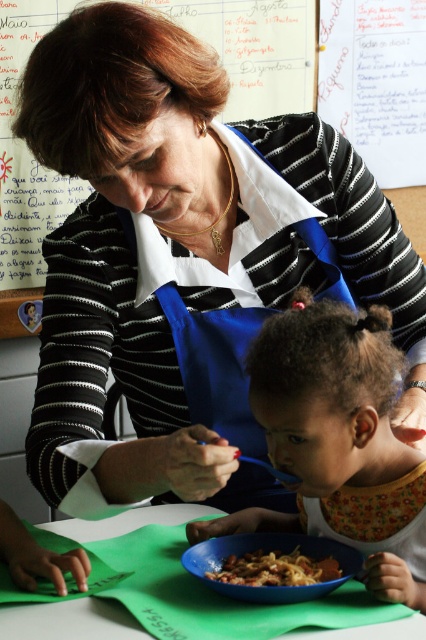
Question: Considering the relative positions of floral bib at lower center and matte plastic bowl at center in the image provided, where is floral bib at lower center located with respect to matte plastic bowl at center?

Choices:
 (A) right
 (B) left

Answer: (A)

Question: Which object is positioned closest to the white paper at upper center?

Choices:
 (A) floral bib at lower center
 (B) matte plastic bowl at center
 (C) green paper at lower center

Answer: (A)

Question: Can you confirm if green paper at lower center is bigger than matte plastic bowl at center?

Choices:
 (A) yes
 (B) no

Answer: (A)

Question: Which object appears closest to the camera in this image?

Choices:
 (A) floral bib at lower center
 (B) white paper at upper center
 (C) green paper at lower center

Answer: (C)

Question: Observing the image, what is the correct spatial positioning of floral bib at lower center in reference to shiny plastic bowl at center?

Choices:
 (A) left
 (B) right

Answer: (B)

Question: Which point is farther to the camera?

Choices:
 (A) green paper at lower center
 (B) shiny plastic bowl at center

Answer: (B)